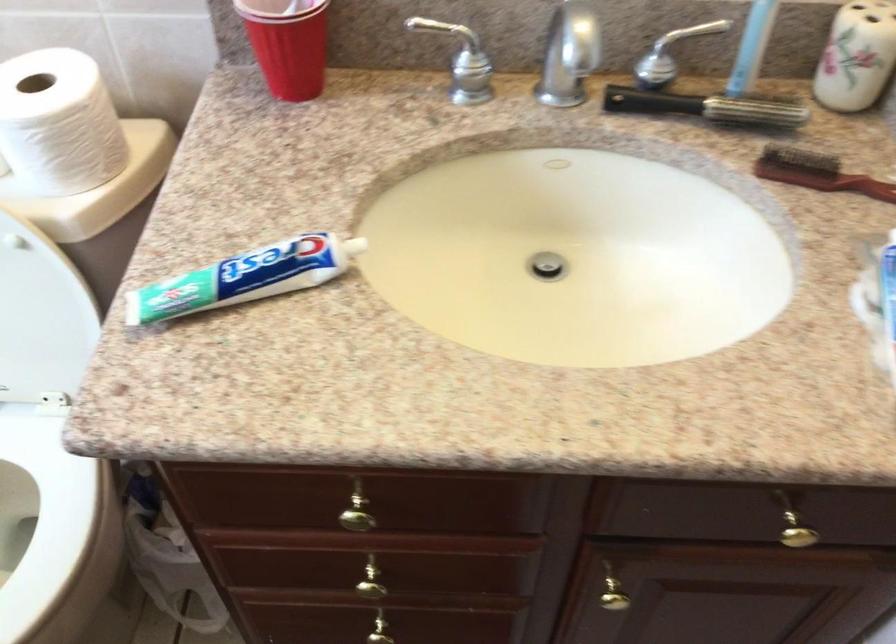
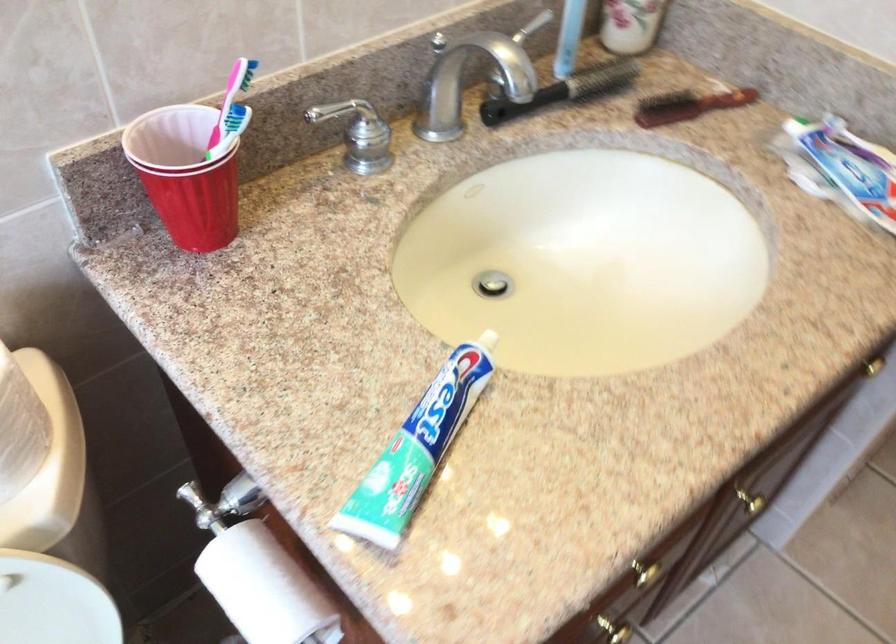
Question: The camera is either moving clockwise (left) or counter-clockwise (right) around the object. The first image is from the beginning of the video and the second image is from the end. Is the camera moving left or right when shooting the video?

Choices:
 (A) Left
 (B) Right

Answer: (A)